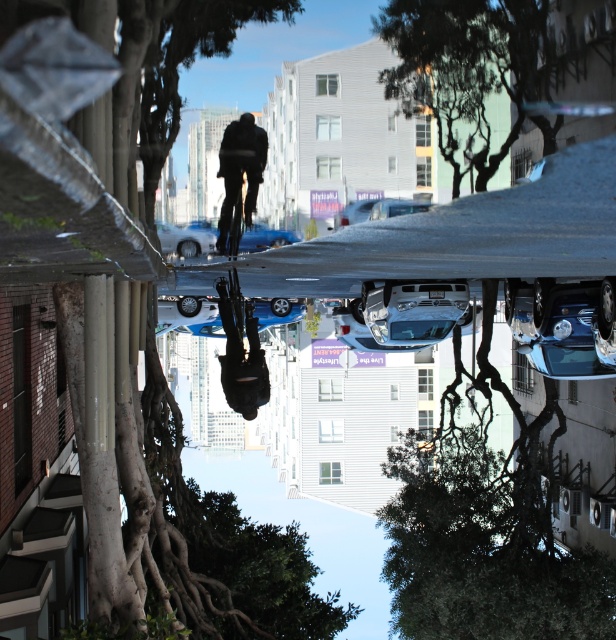
Question: Considering the real-world distances, which object is closest to the shiny black helmet at center?

Choices:
 (A) black matte bicycle at center
 (B) smooth bark tree at lower left
 (C) blue metallic car at center

Answer: (A)

Question: Which point is farther to the camera?

Choices:
 (A) (147, 131)
 (B) (241, 387)
 (C) (245, 138)
 (D) (197, 234)

Answer: (D)

Question: Can you confirm if smooth bark tree at lower left is bigger than black matte bicycle at center?

Choices:
 (A) yes
 (B) no

Answer: (A)

Question: Can you confirm if shiny black helmet at center is positioned above blue metallic car at center?

Choices:
 (A) no
 (B) yes

Answer: (A)

Question: Is smooth bark tree at lower left positioned behind black matte bicycle at center?

Choices:
 (A) yes
 (B) no

Answer: (B)

Question: Considering the real-world distances, which object is farthest from the shiny black helmet at center?

Choices:
 (A) smooth bark tree at lower left
 (B) black matte bicycle at center

Answer: (A)